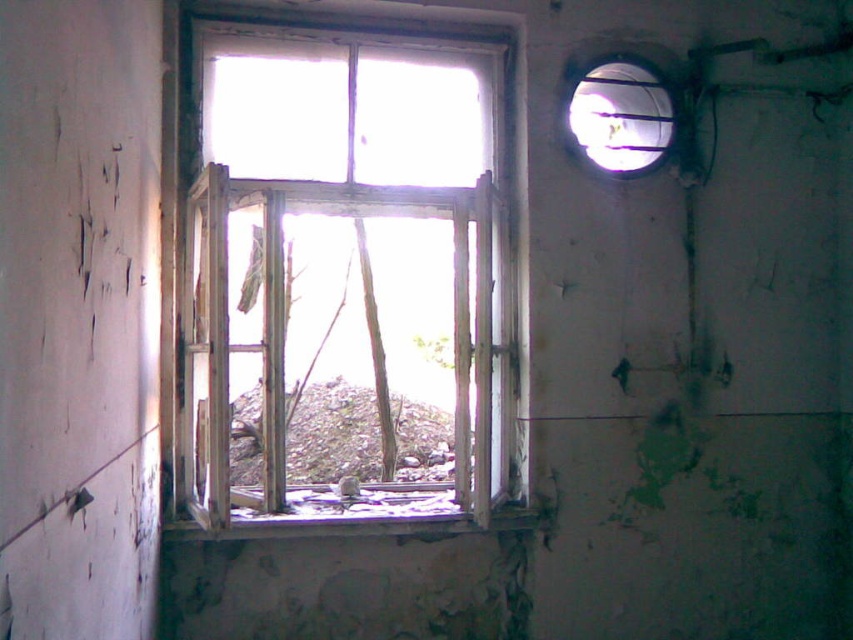
Can you confirm if weathered wood window at center is smaller than rusty metallic debris at center?

Actually, weathered wood window at center might be larger than rusty metallic debris at center.

Which is in front, point (317, 374) or point (440, 458)?

Point (440, 458) is more forward.

Does point (399, 390) lie in front of point (311, 413)?

No, (399, 390) is further to viewer.

You are a GUI agent. You are given a task and a screenshot of the screen. Output one action in this format:
    pyautogui.click(x=<x>, y=<y>)
    Task: Click on the weathered wood window at center
    The height and width of the screenshot is (640, 853).
    Given the screenshot: What is the action you would take?
    pyautogui.click(x=343, y=284)